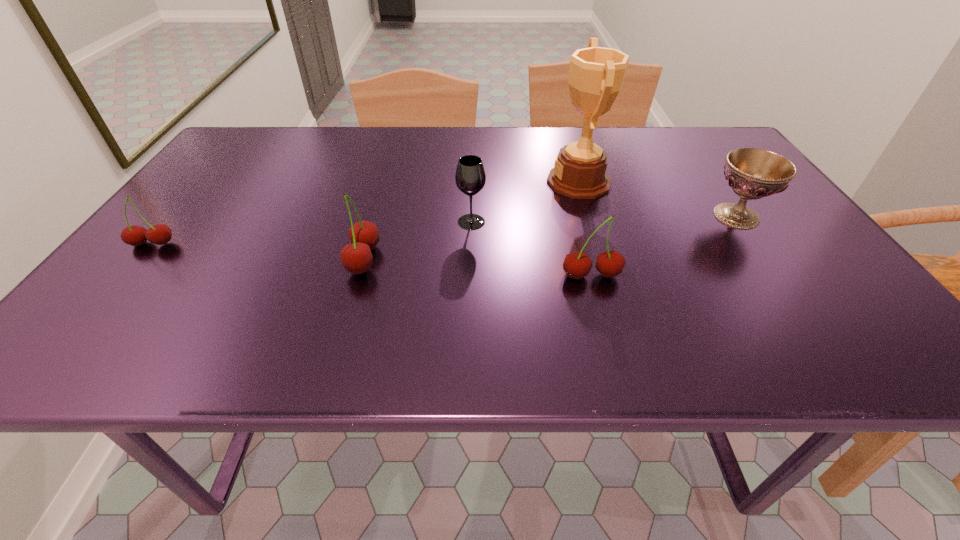
Where is `free space that satisfies the following two spatial constraints: 1. on the front-facing side of the tallest object; 2. on the surface of the leftmost object`? This screenshot has height=540, width=960. free space that satisfies the following two spatial constraints: 1. on the front-facing side of the tallest object; 2. on the surface of the leftmost object is located at coordinates (597, 244).